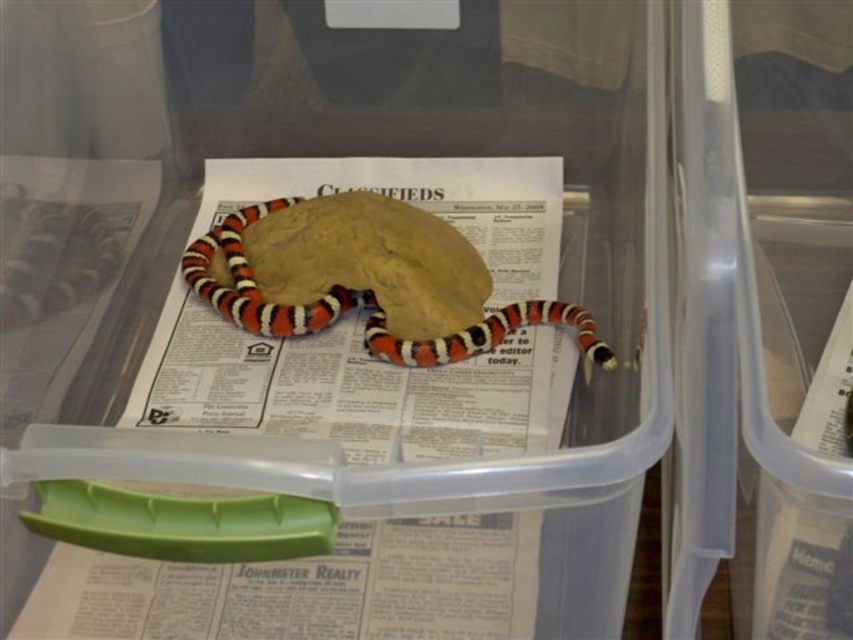
You are a biologist examining the contents of a plastic storage container. You notice two snakes inside. The first is an orange and white striped snake at center, and the second is a smooth glossy snake at left. Which snake is located to the right of the other?

The orange and white striped snake at center is positioned on the right side of the smooth glossy snake at left.